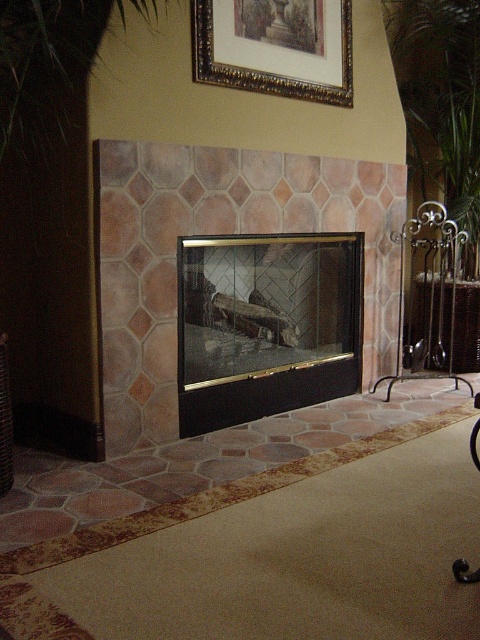
The image size is (480, 640). In order to click on black glass fireplace at center in this screenshot , I will do coord(265,324).

Measure the distance between point (288, 392) and camera.

Point (288, 392) is 12.06 feet away from camera.

Between point (287, 308) and point (0, 120), which one is positioned in front?

Point (0, 120) is in front.

Find the location of `black glass fireplace at center`. black glass fireplace at center is located at coordinates (265, 324).

Which of these two, green leafy plant at upper center or black wrought iron fireplace tool rack at right, stands taller?

black wrought iron fireplace tool rack at right is taller.

Is green leafy plant at upper center positioned in front of black wrought iron fireplace tool rack at right?

Yes.

Which is in front, point (41, 45) or point (410, 285)?

Positioned in front is point (41, 45).

Where is `green leafy plant at upper center`? green leafy plant at upper center is located at coordinates (49, 61).

Which is behind, point (264, 77) or point (420, 237)?

Positioned behind is point (420, 237).

Is gold/gilded picture frame at upper center further to the viewer compared to black wrought iron fireplace tool rack at right?

That is False.

Locate an element on the screen. This screenshot has height=640, width=480. gold/gilded picture frame at upper center is located at coordinates (272, 48).